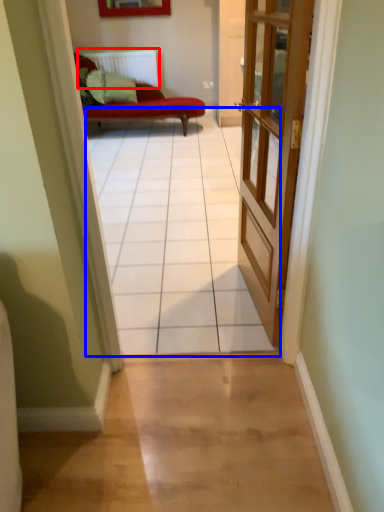
Question: Which of the following is the closest to the observer, radiator (highlighted by a red box) or path (highlighted by a blue box)?

Choices:
 (A) radiator
 (B) path

Answer: (B)